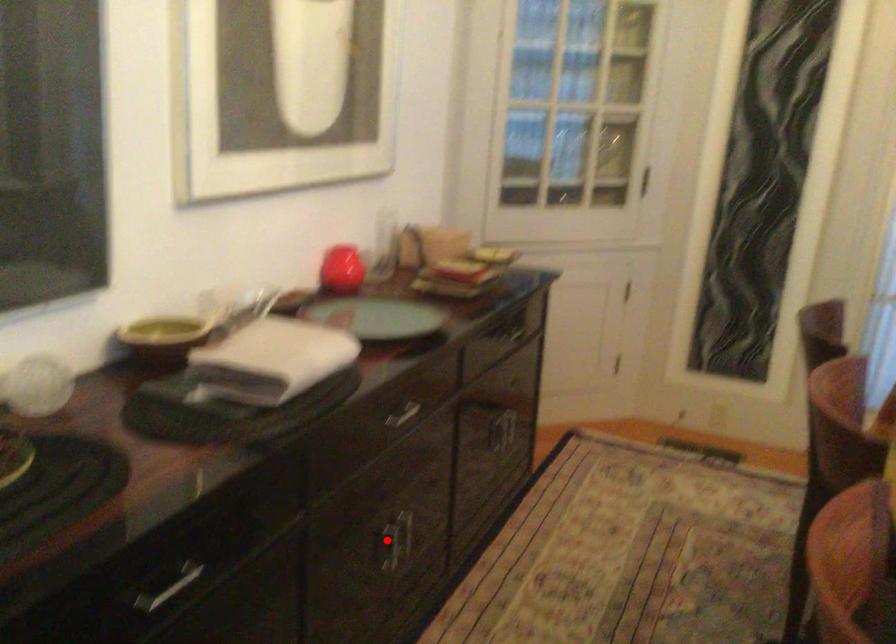
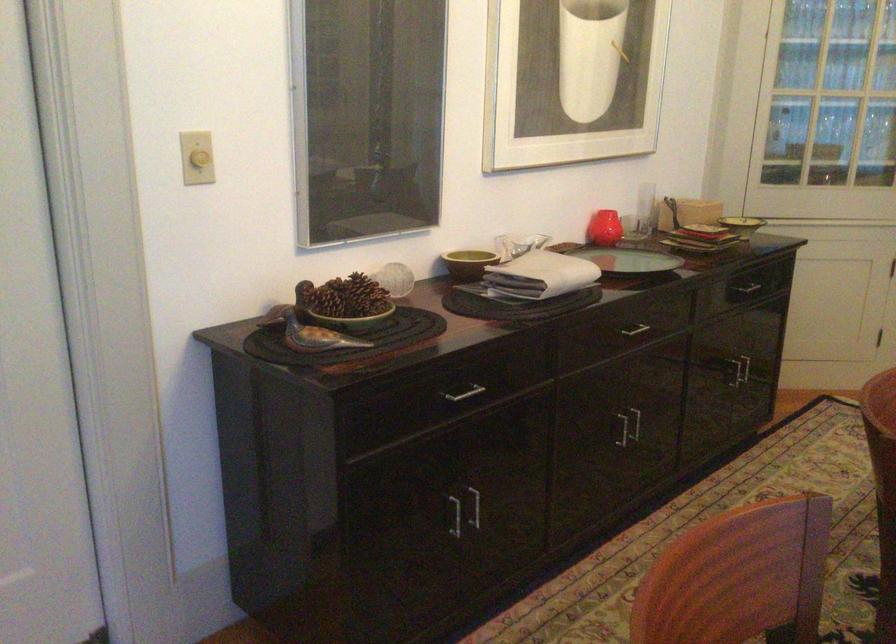
Question: I am providing you with two images of the same scene from different viewpoints. In image1, a red point is highlighted. Considering the same 3D point in image2, which of the following is correct?

Choices:
 (A) It is closer
 (B) It is farther

Answer: (B)